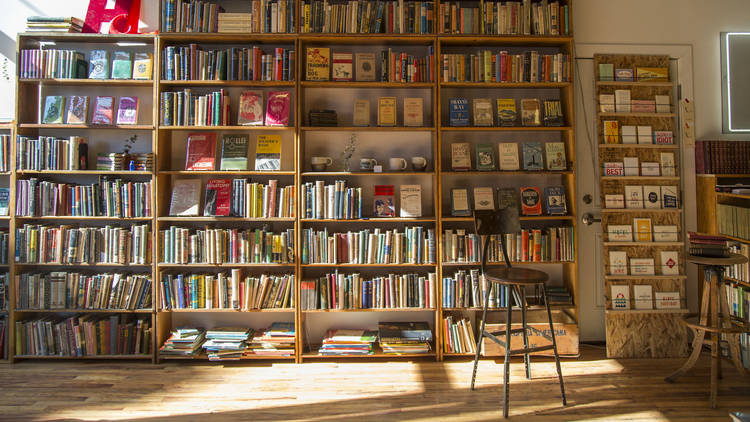
Find the location of a particular element. white wooden door behind small shelf is located at coordinates (595, 208).